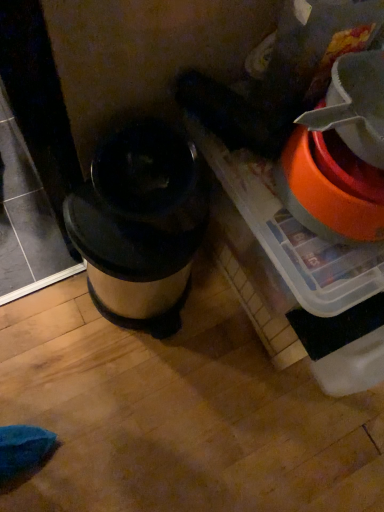
Question: Is orange plastic bucket at right completely or partially outside of metallic silver trash can at center?

Choices:
 (A) no
 (B) yes

Answer: (B)

Question: Is orange plastic bucket at right beside metallic silver trash can at center?

Choices:
 (A) no
 (B) yes

Answer: (A)

Question: From the image's perspective, is orange plastic bucket at right below metallic silver trash can at center?

Choices:
 (A) yes
 (B) no

Answer: (B)

Question: From the image's perspective, is orange plastic bucket at right over metallic silver trash can at center?

Choices:
 (A) no
 (B) yes

Answer: (B)

Question: Is orange plastic bucket at right oriented towards metallic silver trash can at center?

Choices:
 (A) yes
 (B) no

Answer: (B)

Question: Considering the relative sizes of orange plastic bucket at right and metallic silver trash can at center in the image provided, is orange plastic bucket at right taller than metallic silver trash can at center?

Choices:
 (A) no
 (B) yes

Answer: (A)

Question: From a real-world perspective, does metallic silver trash can at center stand above orange plastic bucket at right?

Choices:
 (A) yes
 (B) no

Answer: (B)

Question: Does metallic silver trash can at center come in front of orange plastic bucket at right?

Choices:
 (A) no
 (B) yes

Answer: (A)

Question: Does metallic silver trash can at center appear on the left side of orange plastic bucket at right?

Choices:
 (A) yes
 (B) no

Answer: (A)

Question: From the image's perspective, is metallic silver trash can at center over orange plastic bucket at right?

Choices:
 (A) no
 (B) yes

Answer: (A)

Question: Does metallic silver trash can at center appear on the right side of orange plastic bucket at right?

Choices:
 (A) no
 (B) yes

Answer: (A)

Question: Is metallic silver trash can at center oriented towards orange plastic bucket at right?

Choices:
 (A) no
 (B) yes

Answer: (A)

Question: From the image's perspective, is orange plastic bucket at right positioned above or below metallic silver trash can at center?

Choices:
 (A) above
 (B) below

Answer: (A)